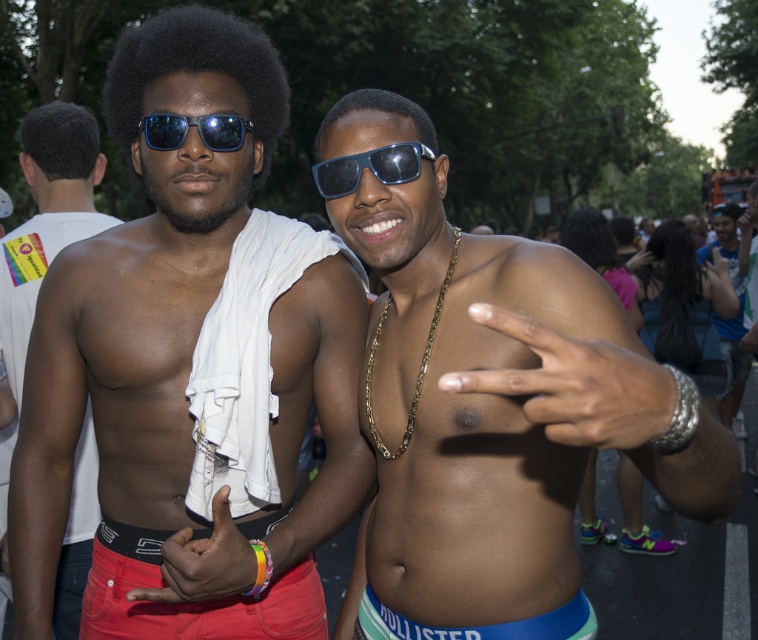
Does black matte afro at upper left appear on the left side of matte red underwear at lower left?

Indeed, black matte afro at upper left is positioned on the left side of matte red underwear at lower left.

Does point (133, 29) lie behind point (274, 600)?

Yes, it is.

Measure the distance between black matte afro at upper left and camera.

They are 1.74 meters apart.

The height and width of the screenshot is (640, 758). Identify the location of black matte afro at upper left. (196, 70).

Which of these two, black matte afro at upper left or blue fabric at lower center, stands shorter?

With less height is blue fabric at lower center.

Is black matte afro at upper left closer to the viewer compared to blue fabric at lower center?

No, it is not.

Does point (124, 148) come in front of point (384, 605)?

That is False.

At what (x,y) coordinates should I click in order to perform the action: click on black matte afro at upper left. Please return your answer as a coordinate pair (x, y). Looking at the image, I should click on (196, 70).

Can you confirm if black matte afro at upper left is shorter than black matte afro at center?

Yes, black matte afro at upper left is shorter than black matte afro at center.

Does point (130, 102) lie in front of point (356, 97)?

No, (130, 102) is behind (356, 97).

The height and width of the screenshot is (640, 758). Find the location of `black matte afro at upper left`. black matte afro at upper left is located at coordinates (196, 70).